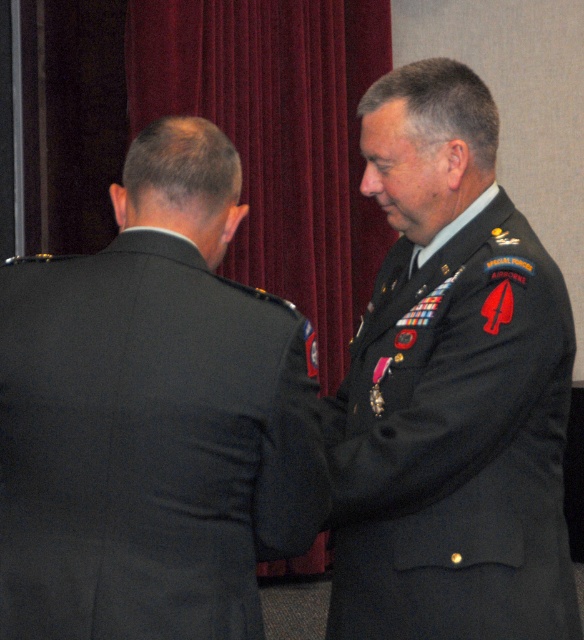
You are standing in the room where the ceremony is taking place. You need to find the black fabric suit at back. According to the coordinates provided, where should you look to locate it?

The black fabric suit at back is located at point coordinates 0.652 on the x axis and 0.262 on the y axis.

You are a photographer standing in front of the scene. You want to take a photo of the dark green fabric military uniform at right and the velvet red curtain at upper center. If your camera can only focus on objects within 8 feet, will both objects be in focus?

The dark green fabric military uniform at right and the velvet red curtain at upper center are 8.69 feet apart from each other. Since the distance between them exceeds the camera focus range of 8 feet, both objects cannot be in focus simultaneously.

You are an event photographer who needs to capture a clear shot of the black fabric suit at back and the velvet red curtain at upper center. Since you can only focus on one object at a time, which object should you focus on to ensure the other is still in the background?

You should focus on the black fabric suit at back because it is positioned on the left side of the velvet red curtain at upper center, meaning the velvet red curtain at upper center will be in the background.